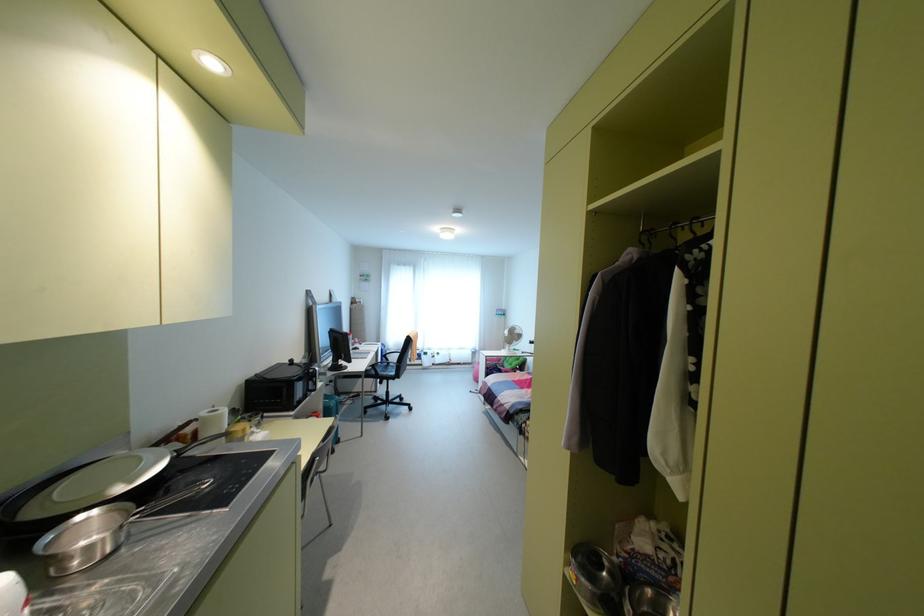
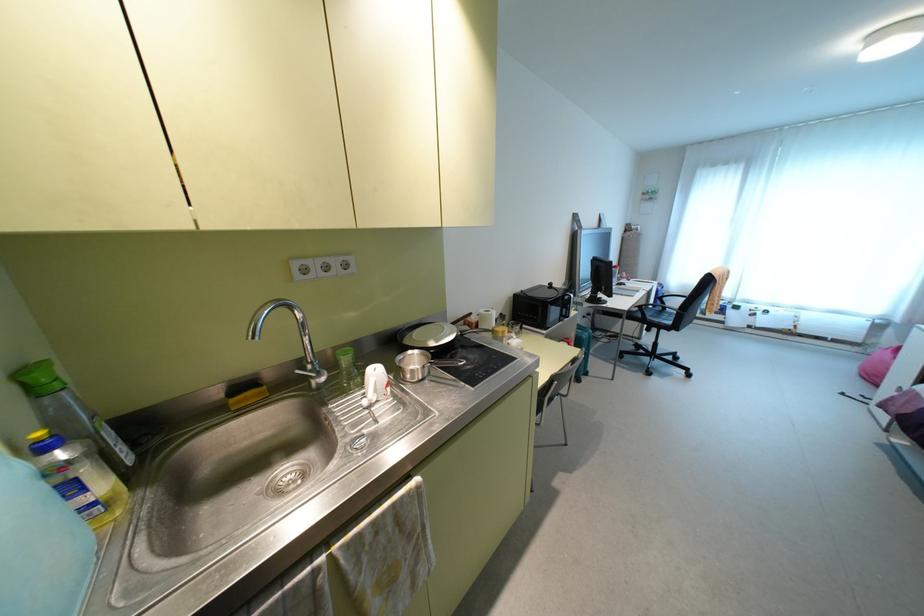
Question: The first image is from the beginning of the video and the second image is from the end. How did the camera likely rotate when shooting the video?

Choices:
 (A) Left
 (B) Right
 (C) Up
 (D) Down

Answer: (A)